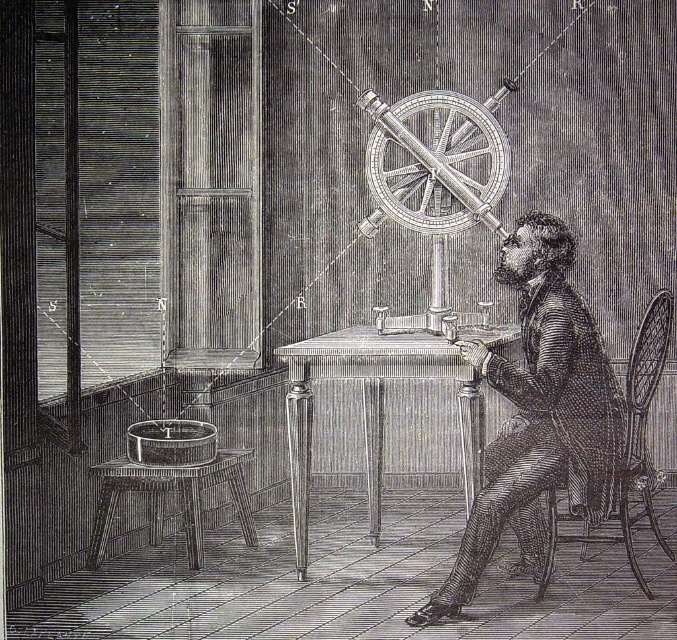
Is point (460, 593) farther from viewer compared to point (624, 461)?

No, (460, 593) is closer to viewer.

Between smooth black coat at center and woven wood chair at right, which one has more height?

With more height is smooth black coat at center.

This screenshot has height=640, width=677. What do you see at coordinates (538, 413) in the screenshot?
I see `smooth black coat at center` at bounding box center [538, 413].

Where is `smooth black coat at center`? The width and height of the screenshot is (677, 640). smooth black coat at center is located at coordinates (538, 413).

Can you confirm if smooth black coat at center is positioned below metallic/textured wheel at center?

Yes.

Is point (559, 385) positioned in front of point (450, 100)?

That is True.

You are a GUI agent. You are given a task and a screenshot of the screen. Output one action in this format:
    pyautogui.click(x=<x>, y=<y>)
    Task: Click on the smooth black coat at center
    The image size is (677, 640).
    Given the screenshot: What is the action you would take?
    pyautogui.click(x=538, y=413)

Is wooden table at center thinner than woven wood chair at right?

Incorrect, wooden table at center's width is not less than woven wood chair at right's.

Is wooden table at center to the left of woven wood chair at right from the viewer's perspective?

Indeed, wooden table at center is positioned on the left side of woven wood chair at right.

Identify the location of wooden table at center. (383, 397).